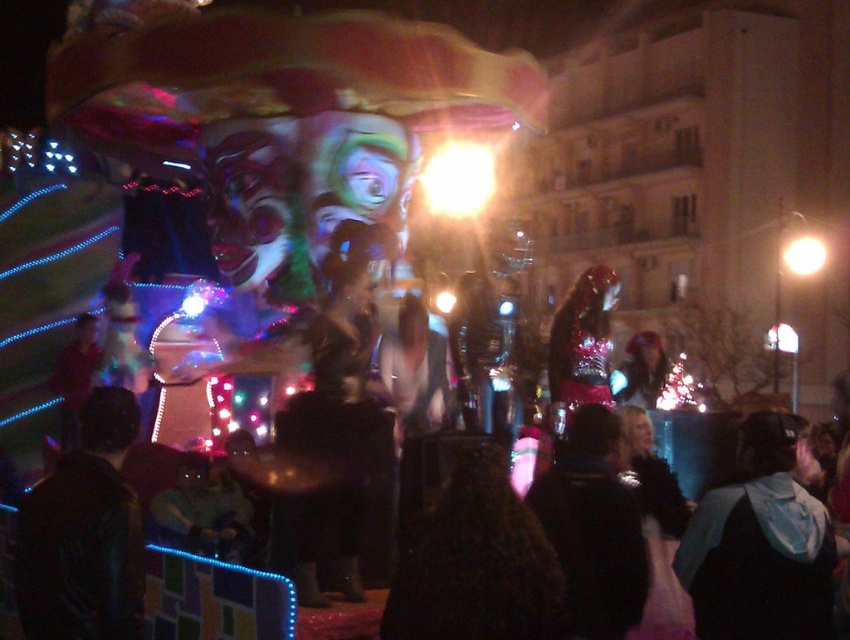
Which is behind, point (105, 442) or point (816, 256)?

Point (816, 256)

Who is more forward, (128, 609) or (785, 268)?

Point (128, 609)

At what (x,y) coordinates should I click in order to perform the action: click on leather jacket at lower left. Please return your answer as a coordinate pair (x, y). The width and height of the screenshot is (850, 640). Looking at the image, I should click on (85, 534).

Between point (707, 577) and point (809, 240), which one is positioned behind?

Point (809, 240)

Between point (726, 502) and point (808, 248), which one is positioned in front?

Point (726, 502)

Where is `black fabric jacket at lower right`? The image size is (850, 640). black fabric jacket at lower right is located at coordinates (760, 547).

Does black fabric jacket at lower right have a greater width compared to shiny metallic helmet at center?

No.

Is point (694, 561) behind point (643, 346)?

No, (694, 561) is in front of (643, 346).

Describe the element at coordinates (760, 547) in the screenshot. I see `black fabric jacket at lower right` at that location.

In order to click on black fabric jacket at lower right in this screenshot , I will do click(760, 547).